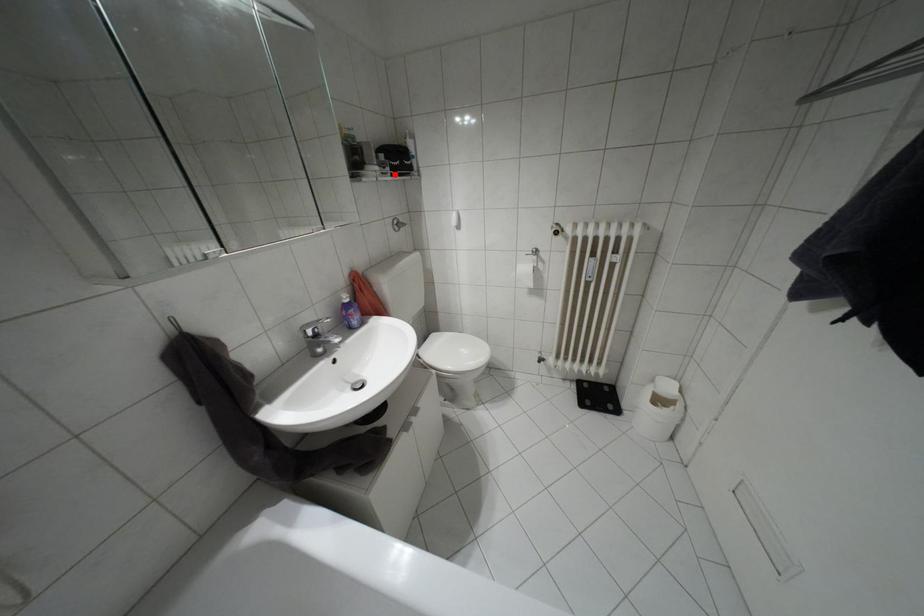
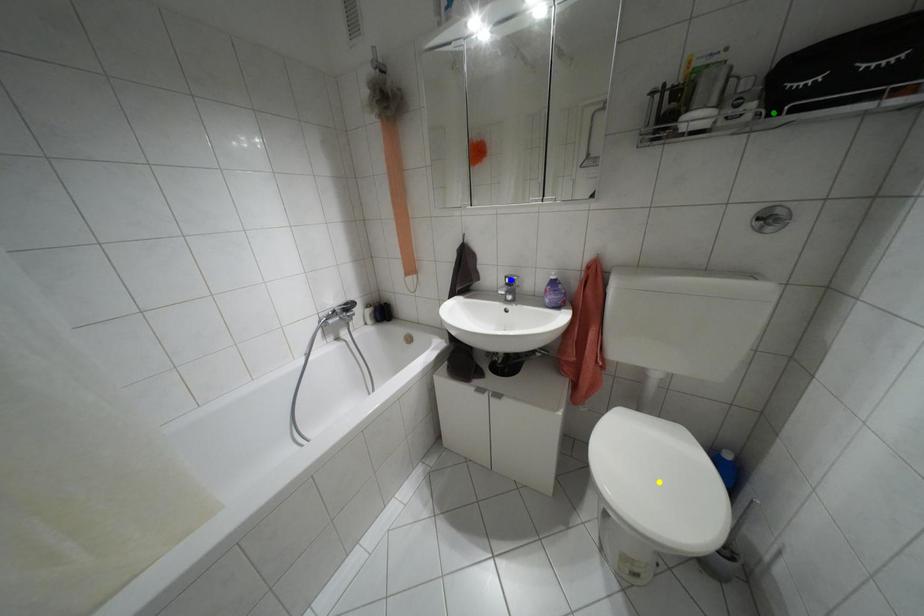
Question: I am providing you with two images of the same scene from different viewpoints. A red point is marked on the first image. You are given multiple points on the second image. Which mark in image 2 goes with the point in image 1?

Choices:
 (A) yellow point
 (B) blue point
 (C) green point

Answer: (C)